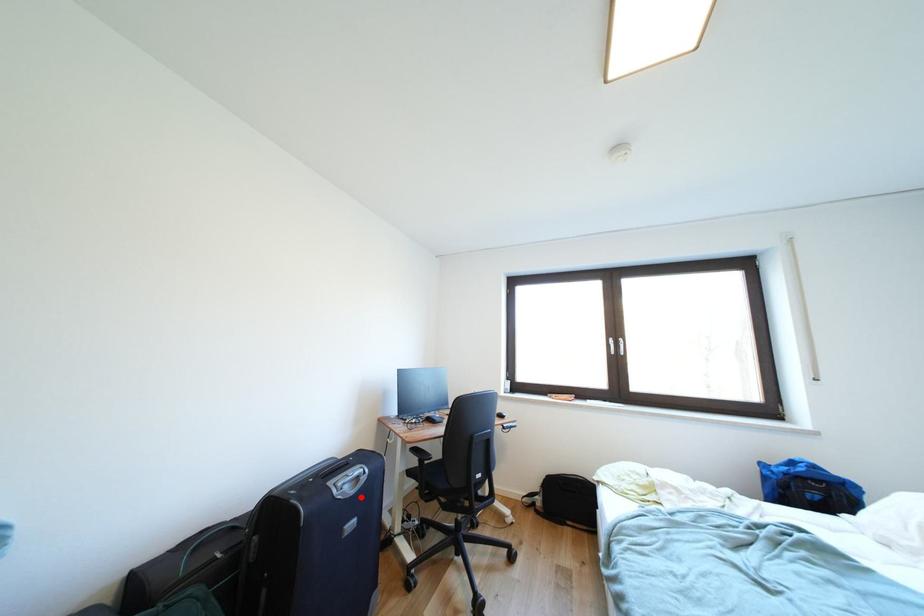
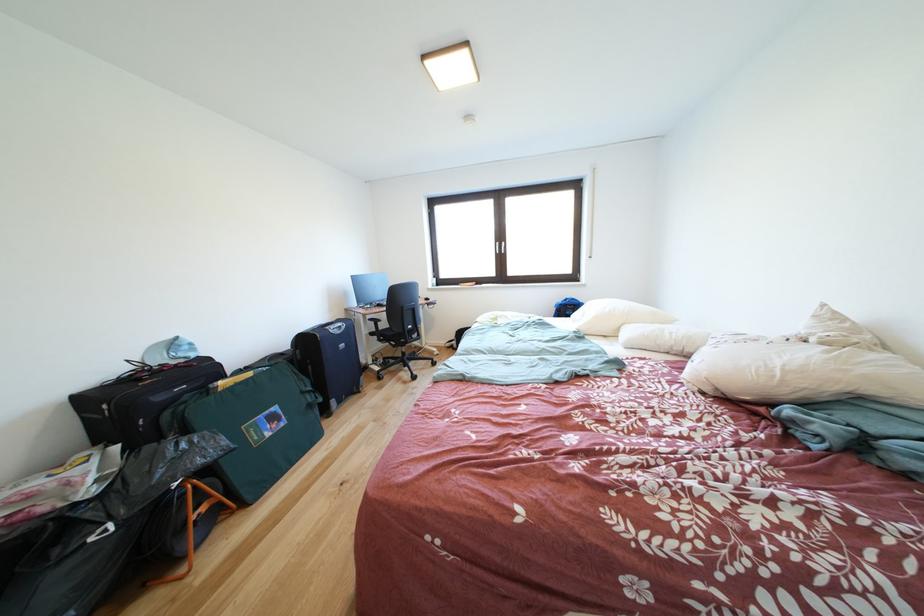
Question: I am providing you with two images of the same scene from different viewpoints. A red point is marked on the first image. Is the red point's position out of view in image 2?

Choices:
 (A) Yes
 (B) No

Answer: (B)